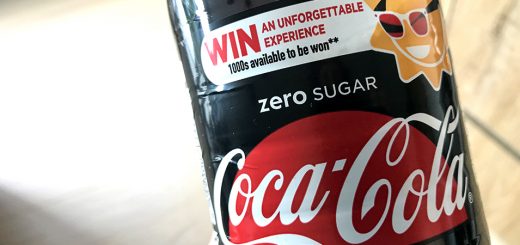
Locate an element on the screen. tab;e is located at coordinates (68, 91).